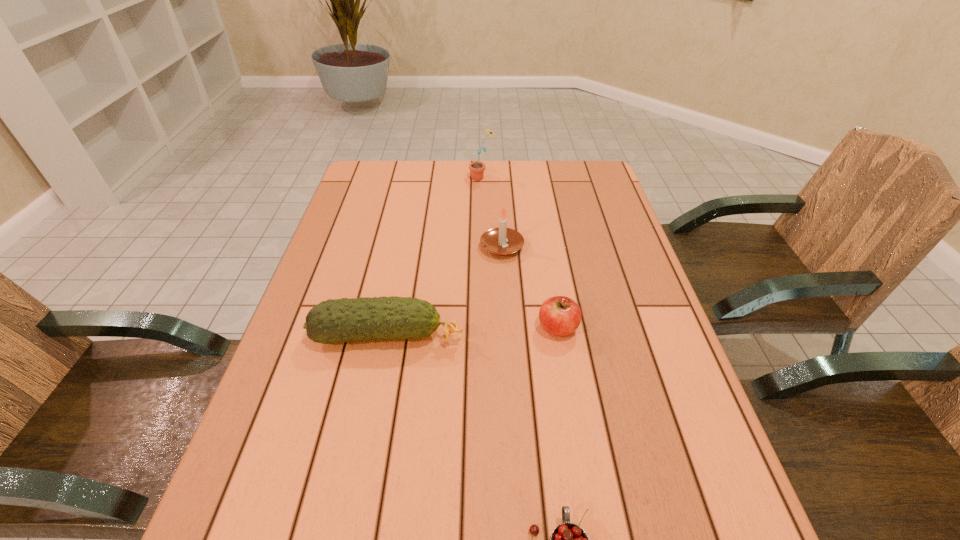
Identify the location of free space that satisfies the following two spatial constraints: 1. on the flower of the apple; 2. on the right side of the sunflower. The height and width of the screenshot is (540, 960). (483, 328).

I want to click on vacant area in the image that satisfies the following two spatial constraints: 1. on the flower of the farthest object; 2. on the back side of the second farthest object, so click(483, 247).

Locate an element on the screen. free spot that satisfies the following two spatial constraints: 1. on the flower of the apple; 2. on the right side of the sunflower is located at coordinates (483, 328).

Find the location of `vacant area in the image that satisfies the following two spatial constraints: 1. on the flower of the apple; 2. on the right side of the tallest object`. vacant area in the image that satisfies the following two spatial constraints: 1. on the flower of the apple; 2. on the right side of the tallest object is located at coordinates (483, 328).